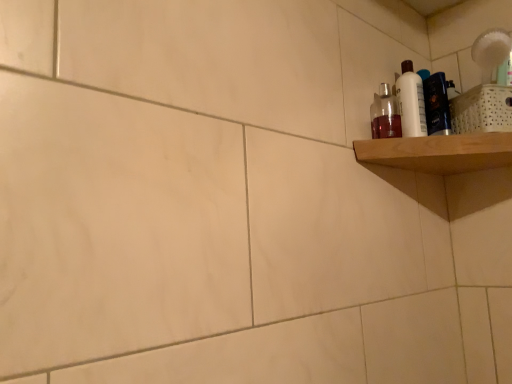
Question: Does point (382, 112) appear closer or farther from the camera than point (403, 97)?

Choices:
 (A) closer
 (B) farther

Answer: (B)

Question: From the image's perspective, is translucent plastic bottle at upper right above or below white glossy bottle at upper right?

Choices:
 (A) below
 (B) above

Answer: (A)

Question: Estimate the real-world distances between objects in this image. Which object is closer to the wooden shelf at upper right?

Choices:
 (A) white glossy bottle at upper right
 (B) translucent plastic bottle at upper right

Answer: (A)

Question: Estimate the real-world distances between objects in this image. Which object is farther from the wooden shelf at upper right?

Choices:
 (A) translucent plastic bottle at upper right
 (B) white glossy bottle at upper right

Answer: (A)